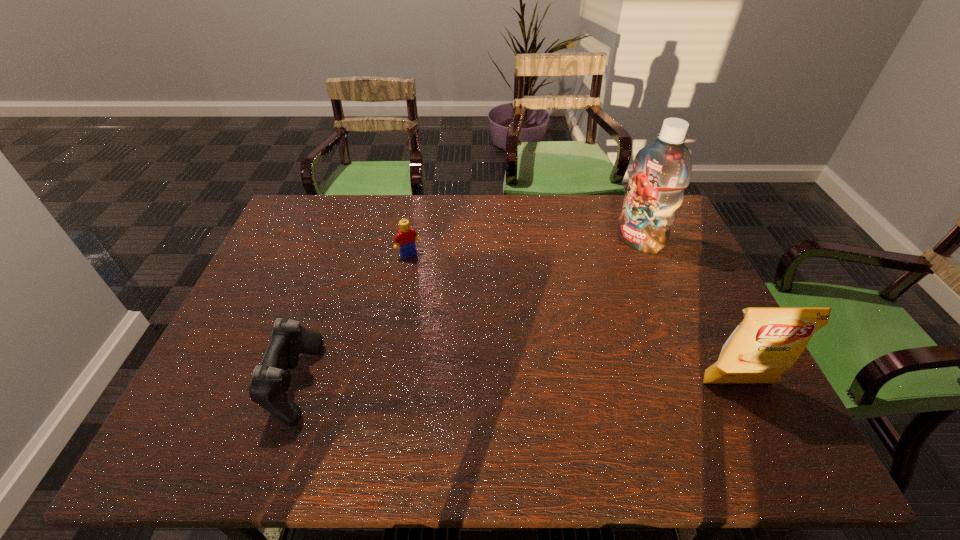
I want to click on vacant space located on the face of the Lego, so pos(449,307).

This screenshot has width=960, height=540. Identify the location of vacant position located on the face of the Lego. (468, 332).

At what (x,y) coordinates should I click in order to perform the action: click on free space located 0.130m on the face of the Lego. Please return your answer as a coordinate pair (x, y). Looking at the image, I should click on [433, 285].

This screenshot has width=960, height=540. What are the coordinates of `object that is at the far edge` in the screenshot? It's located at (662, 170).

Locate an element on the screen. The width and height of the screenshot is (960, 540). control situated at the near edge is located at coordinates (269, 382).

You are a GUI agent. You are given a task and a screenshot of the screen. Output one action in this format:
    pyautogui.click(x=<x>, y=<y>)
    Task: Click on the crisp (potato chip) present at the near edge
    
    Given the screenshot: What is the action you would take?
    pyautogui.click(x=769, y=340)

Image resolution: width=960 pixels, height=540 pixels. In order to click on crisp (potato chip) situated at the right edge in this screenshot , I will do `click(769, 340)`.

What are the coordinates of `shampoo positioned at the right edge` in the screenshot? It's located at (662, 170).

You are a GUI agent. You are given a task and a screenshot of the screen. Output one action in this format:
    pyautogui.click(x=<x>, y=<y>)
    Task: Click on the object that is at the far right corner
    
    Given the screenshot: What is the action you would take?
    pyautogui.click(x=662, y=170)

This screenshot has width=960, height=540. Identify the location of object that is at the near right corner. [769, 340].